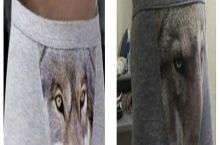
Where is `white object on shelf`? white object on shelf is located at coordinates (120, 67).